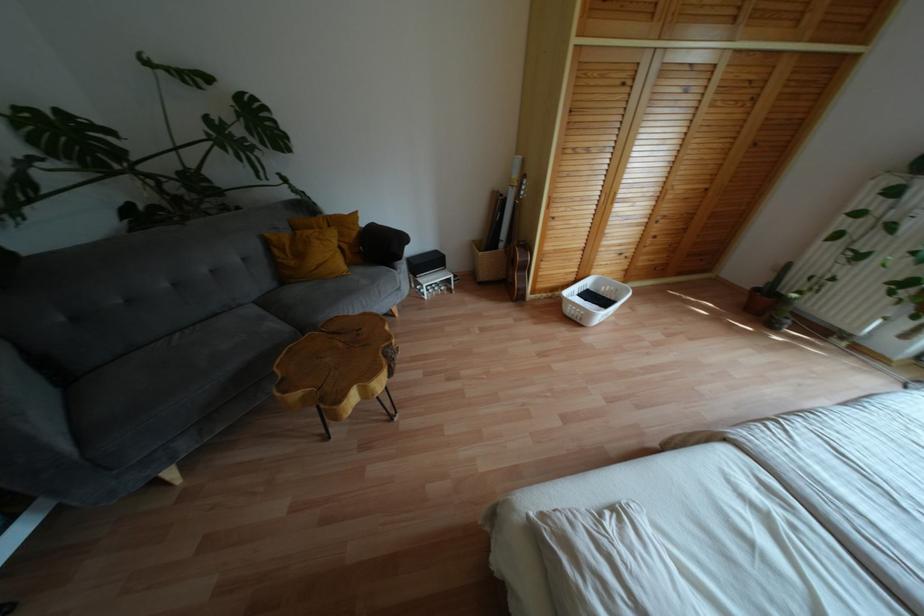
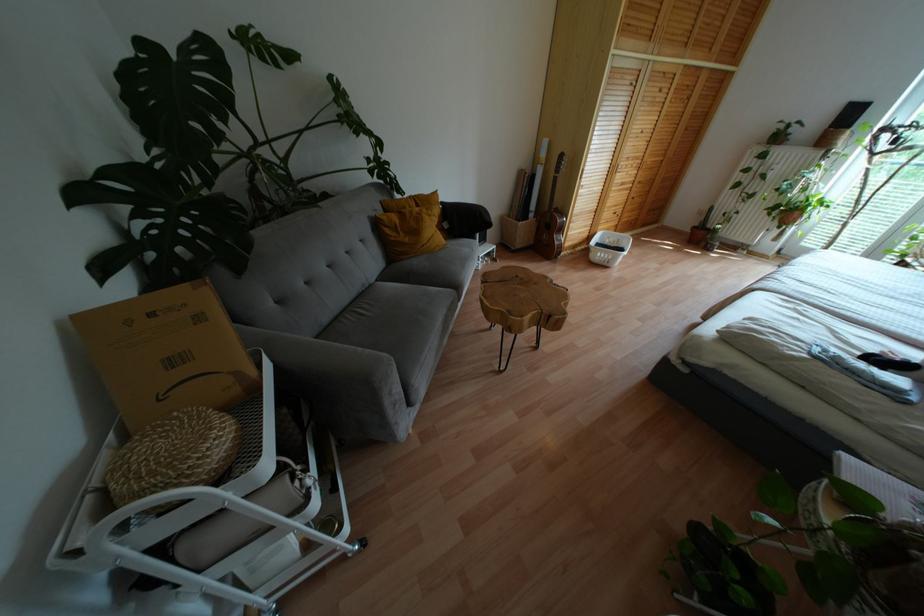
Where in the second image is the point corresponding to (x=757, y=290) from the first image?

(694, 227)